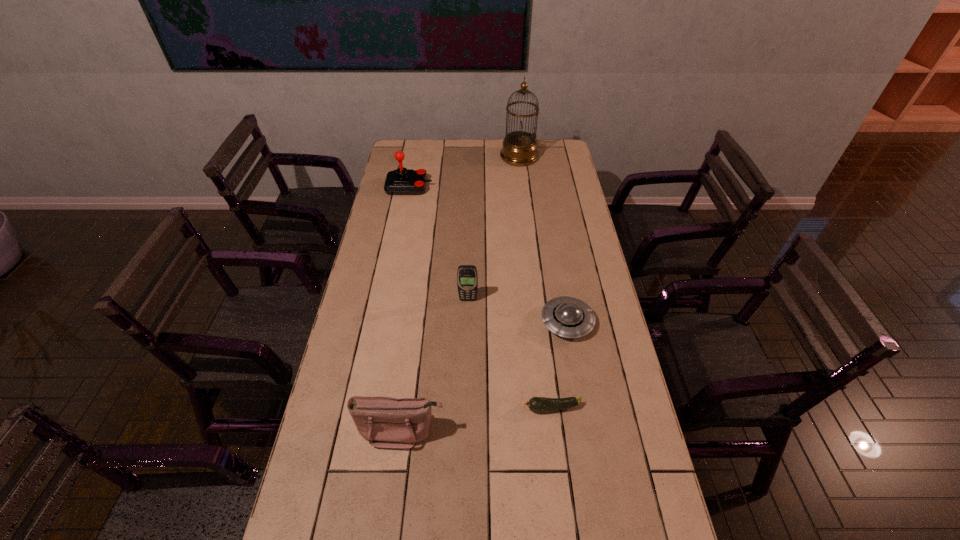
The height and width of the screenshot is (540, 960). I want to click on joystick positioned at the left edge, so click(x=402, y=181).

Find the location of a particular element. This screenshot has height=540, width=960. shoulder bag present at the left edge is located at coordinates (386, 422).

Identify the location of birdcage at the right edge. This screenshot has width=960, height=540. (519, 148).

The height and width of the screenshot is (540, 960). I want to click on saucer located in the right edge section of the desktop, so click(x=569, y=317).

Where is `zucchini that is at the right edge`? Image resolution: width=960 pixels, height=540 pixels. zucchini that is at the right edge is located at coordinates (536, 404).

This screenshot has height=540, width=960. What are the coordinates of `object that is at the far right corner` in the screenshot? It's located at (519, 148).

Where is `vacant space at the left edge of the desktop`? vacant space at the left edge of the desktop is located at coordinates (311, 471).

The width and height of the screenshot is (960, 540). In order to click on vacant space at the right edge of the desktop in this screenshot , I will do `click(595, 390)`.

Find the location of a particular element. vacant position at the far left corner of the desktop is located at coordinates (421, 156).

You are a GUI agent. You are given a task and a screenshot of the screen. Output one action in this format:
    pyautogui.click(x=<x>, y=<y>)
    Task: Click on the vacant space at the far right corner of the desktop
    The image size is (960, 540).
    Given the screenshot: What is the action you would take?
    pyautogui.click(x=553, y=164)